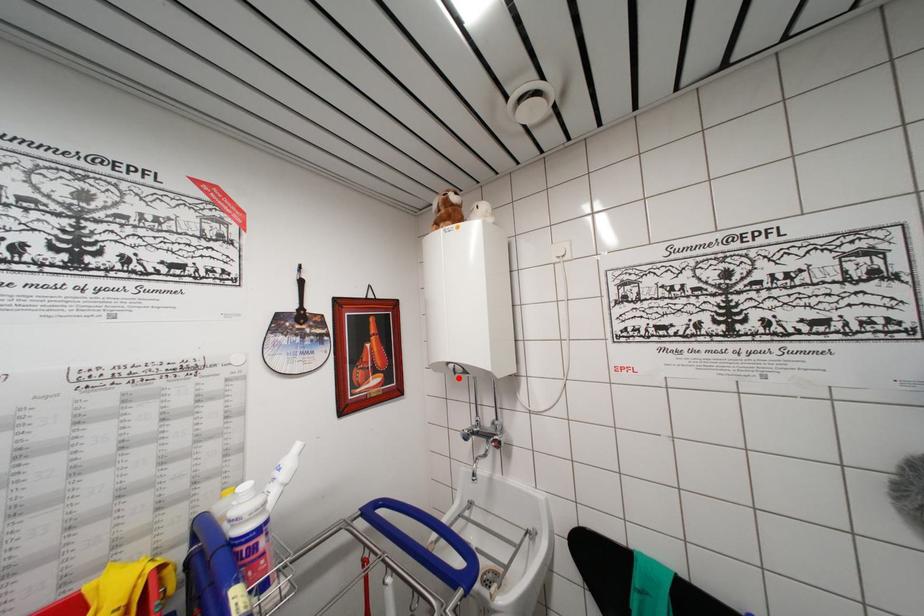
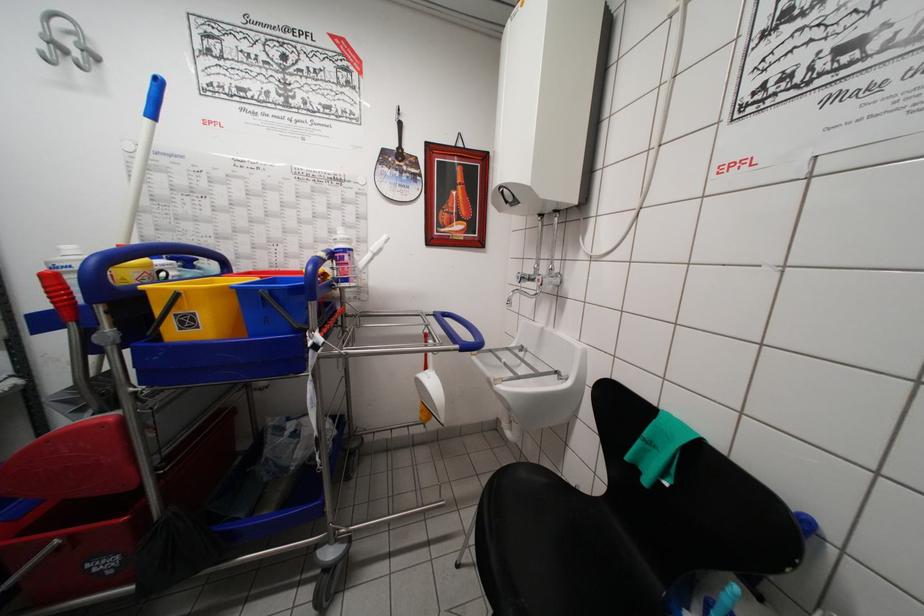
Find the pixel in the second image that matches the highlighted location in the first image.

(511, 207)